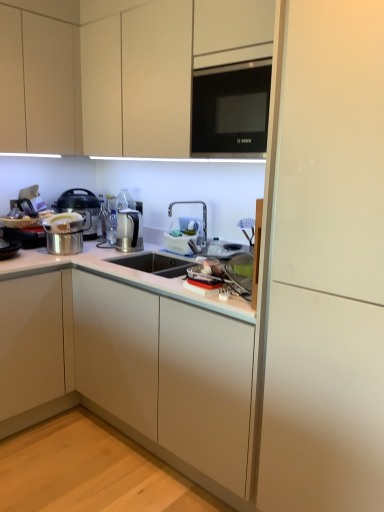
Measure the distance between metallic silver pressure cooker at left and camera.

metallic silver pressure cooker at left and camera are 2.61 meters apart.

The width and height of the screenshot is (384, 512). Describe the element at coordinates (128, 231) in the screenshot. I see `satin silver coffee machine at center` at that location.

What is the approximate width of white glossy sink at center?

white glossy sink at center is 7.57 inches in width.

This screenshot has height=512, width=384. What do you see at coordinates (116, 70) in the screenshot? I see `matte white cabinet at upper center, marked as the second cabinetry in a bottom-to-top arrangement` at bounding box center [116, 70].

The height and width of the screenshot is (512, 384). Describe the element at coordinates (129, 361) in the screenshot. I see `white glossy cabinet at center, the second cabinetry when ordered from top to bottom` at that location.

Identify the location of metallic silver pressure cooker at left. The width and height of the screenshot is (384, 512). (81, 208).

Considering the sizes of objects satin silver coffee machine at center and black glass microwave at upper center in the image provided, who is smaller, satin silver coffee machine at center or black glass microwave at upper center?

With smaller size is satin silver coffee machine at center.

From the image's perspective, which one is positioned lower, satin silver coffee machine at center or black glass microwave at upper center?

From the image's view, satin silver coffee machine at center is below.

What's the angular difference between satin silver coffee machine at center and black glass microwave at upper center's facing directions?

satin silver coffee machine at center and black glass microwave at upper center are facing 2.49 degrees away from each other.

Would you say satin silver coffee machine at center is inside or outside black glass microwave at upper center?

satin silver coffee machine at center lies outside black glass microwave at upper center.

Which is nearer, (119,243) or (169,234)?

The point (169,234) is more forward.

From the image's perspective, is satin silver coffee machine at center on white plastic basket at center?

Indeed, from the image's perspective, satin silver coffee machine at center is shown above white plastic basket at center.

Is satin silver coffee machine at center further to the viewer compared to white plastic basket at center?

Yes, it is.

How different are the orientations of black glass microwave at upper center and white glossy sink at center in degrees?

black glass microwave at upper center and white glossy sink at center are facing 1.13 degrees away from each other.

Which object is positioned more to the left, black glass microwave at upper center or white glossy sink at center?

From the viewer's perspective, white glossy sink at center appears more on the left side.

Is black glass microwave at upper center positioned with its back to white glossy sink at center?

black glass microwave at upper center is not turned away from white glossy sink at center.

Considering the positions of points (220, 67) and (213, 239), is point (220, 67) farther from camera compared to point (213, 239)?

That is False.

Where is `microwave that appears above the white glossy cabinet at center, the second cabinetry when ordered from top to bottom (from the image's perspective)`? microwave that appears above the white glossy cabinet at center, the second cabinetry when ordered from top to bottom (from the image's perspective) is located at coordinates (231, 109).

Considering the relative sizes of white glossy cabinet at center, the second cabinetry when ordered from top to bottom, and black glass microwave at upper center in the image provided, is white glossy cabinet at center, the second cabinetry when ordered from top to bottom, bigger than black glass microwave at upper center?

Correct, white glossy cabinet at center, the second cabinetry when ordered from top to bottom, is larger in size than black glass microwave at upper center.

Which object is wider, white glossy cabinet at center, which appears as the 1th cabinetry when ordered from the bottom, or black glass microwave at upper center?

white glossy cabinet at center, which appears as the 1th cabinetry when ordered from the bottom, is wider.

Could black glass microwave at upper center be considered to be inside white glossy cabinet at center, the second cabinetry when ordered from top to bottom?

Definitely not — black glass microwave at upper center is not inside white glossy cabinet at center, the second cabinetry when ordered from top to bottom.

At what (x,y) coordinates should I click in order to perform the action: click on cabinetry in front of the matte white cabinet at upper center, acting as the 1th cabinetry starting from the top. Please return your answer as a coordinate pair (x, y). Looking at the image, I should click on (129, 361).

Is white glossy cabinet at center, which appears as the 1th cabinetry when ordered from the bottom, surrounding matte white cabinet at upper center, acting as the 1th cabinetry starting from the top?

That's incorrect, matte white cabinet at upper center, acting as the 1th cabinetry starting from the top, is not inside white glossy cabinet at center, which appears as the 1th cabinetry when ordered from the bottom.

Considering the positions of objects white glossy cabinet at center, which appears as the 1th cabinetry when ordered from the bottom, and matte white cabinet at upper center, acting as the 1th cabinetry starting from the top, in the image provided, who is more to the left, white glossy cabinet at center, which appears as the 1th cabinetry when ordered from the bottom, or matte white cabinet at upper center, acting as the 1th cabinetry starting from the top,?

Positioned to the left is white glossy cabinet at center, which appears as the 1th cabinetry when ordered from the bottom.

Based on the photo, from the image's perspective, who appears lower, white glossy cabinet at center, the second cabinetry when ordered from top to bottom, or matte white cabinet at upper center, acting as the 1th cabinetry starting from the top?

white glossy cabinet at center, the second cabinetry when ordered from top to bottom, appears lower in the image.

Is satin silver coffee machine at center not near white glossy sink at center?

They are positioned close to each other.

Does satin silver coffee machine at center have a lesser width compared to white glossy sink at center?

Result: Indeed, satin silver coffee machine at center has a lesser width compared to white glossy sink at center.

Considering the relative sizes of satin silver coffee machine at center and white glossy sink at center in the image provided, is satin silver coffee machine at center taller than white glossy sink at center?

In fact, satin silver coffee machine at center may be shorter than white glossy sink at center.

Can you confirm if matte white cabinet at upper center, acting as the 1th cabinetry starting from the top, is smaller than black glass microwave at upper center?

No.

From the image's perspective, is matte white cabinet at upper center, marked as the second cabinetry in a bottom-to-top arrangement, under black glass microwave at upper center?

No, from the image's perspective, matte white cabinet at upper center, marked as the second cabinetry in a bottom-to-top arrangement, is not below black glass microwave at upper center.

Is the depth of matte white cabinet at upper center, marked as the second cabinetry in a bottom-to-top arrangement, greater than that of black glass microwave at upper center?

That is False.

In terms of height, does matte white cabinet at upper center, acting as the 1th cabinetry starting from the top, look taller or shorter compared to black glass microwave at upper center?

In the image, matte white cabinet at upper center, acting as the 1th cabinetry starting from the top, appears to be taller than black glass microwave at upper center.

I want to click on microwave in front of the satin silver coffee machine at center, so click(231, 109).

You are a GUI agent. You are given a task and a screenshot of the screen. Output one action in this format:
    pyautogui.click(x=<x>, y=<y>)
    Task: Click on the coffee machine above the white plastic basket at center (from the image's perspective)
    This screenshot has width=384, height=512.
    Given the screenshot: What is the action you would take?
    pyautogui.click(x=128, y=231)

Based on their spatial positions, is white glossy cabinet at center, which appears as the 1th cabinetry when ordered from the bottom, or satin silver coffee machine at center closer to white plastic basket at center?

satin silver coffee machine at center is closer to white plastic basket at center.

Based on their spatial positions, is black glass microwave at upper center or white plastic basket at center closer to white glossy cabinet at center, the second cabinetry when ordered from top to bottom?

white plastic basket at center is closer to white glossy cabinet at center, the second cabinetry when ordered from top to bottom.

Which object lies further to the anchor point white plastic basket at center, metallic silver pressure cooker at left or white matte cabinet at right?

white matte cabinet at right is further to white plastic basket at center.

Based on their spatial positions, is white matte cabinet at right or metallic silver pressure cooker at left closer to satin silver coffee machine at center?

The object closer to satin silver coffee machine at center is metallic silver pressure cooker at left.

When comparing their distances from black glass microwave at upper center, does white glossy sink at center or white matte cabinet at right seem further?

The object further to black glass microwave at upper center is white matte cabinet at right.

Based on their spatial positions, is white plastic basket at center or black glass microwave at upper center further from white glossy cabinet at center, which appears as the 1th cabinetry when ordered from the bottom?

black glass microwave at upper center is positioned further to the anchor white glossy cabinet at center, which appears as the 1th cabinetry when ordered from the bottom.

Based on their spatial positions, is white matte cabinet at right or black glass microwave at upper center closer to matte white cabinet at upper center, acting as the 1th cabinetry starting from the top?

black glass microwave at upper center is positioned closer to the anchor matte white cabinet at upper center, acting as the 1th cabinetry starting from the top.

From the image, which object appears to be farther from white glossy sink at center, black glass microwave at upper center or white plastic basket at center?

black glass microwave at upper center is positioned further to the anchor white glossy sink at center.

At what (x,y) coordinates should I click in order to perform the action: click on cabinetry between white matte cabinet at right and metallic silver pressure cooker at left in the front-back direction. Please return your answer as a coordinate pair (x, y). Looking at the image, I should click on (116, 70).

This screenshot has height=512, width=384. I want to click on appliance positioned between white glossy cabinet at center, the second cabinetry when ordered from top to bottom, and satin silver coffee machine at center from near to far, so click(x=182, y=234).

What are the coordinates of `side between white glossy cabinet at center, which appears as the 1th cabinetry when ordered from the bottom, and metallic silver pressure cooker at left from front to back` in the screenshot? It's located at (327, 266).

Where is `appliance between white matte cabinet at right and satin silver coffee machine at center from front to back`? Image resolution: width=384 pixels, height=512 pixels. appliance between white matte cabinet at right and satin silver coffee machine at center from front to back is located at coordinates (182, 234).